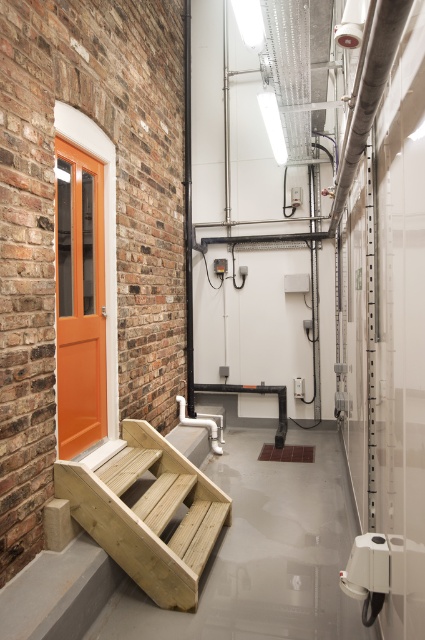
Does natural wood stairs at lower left come behind orange painted wood door at left?

No, it is in front of orange painted wood door at left.

Does natural wood stairs at lower left have a greater height compared to orange painted wood door at left?

In fact, natural wood stairs at lower left may be shorter than orange painted wood door at left.

Who is more distant from viewer, (187, 550) or (85, 326)?

The point (85, 326) is more distant.

Where is `natural wood stairs at lower left`? This screenshot has height=640, width=425. natural wood stairs at lower left is located at coordinates (149, 513).